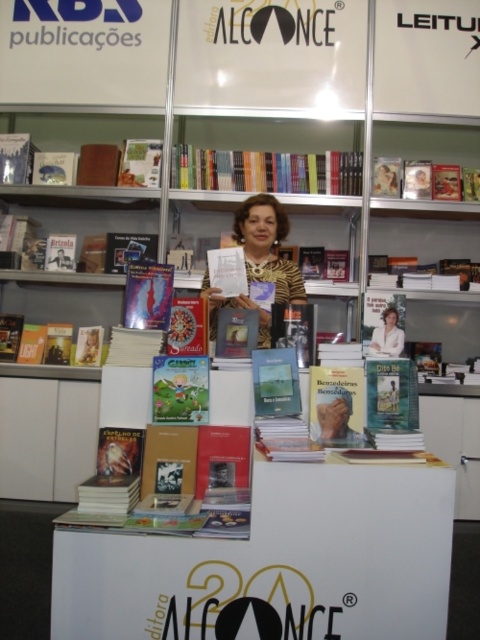
Please provide the 2D coordinates of the matte yellow book at center in the scene.

The matte yellow book at center is located at coordinates (336,406).

You are a customer at the Editora Alcance book fair booth. You want to pick up the hardcover book at center and the hardcover book at lower left. If you can only carry items within a 7 feet reach, can you comfortably reach both books without moving your position?

The distance between the hardcover book at center and the hardcover book at lower left is 6.52 feet, which is within your 7 feet reach limit. Therefore, you can comfortably reach both books without moving your position.